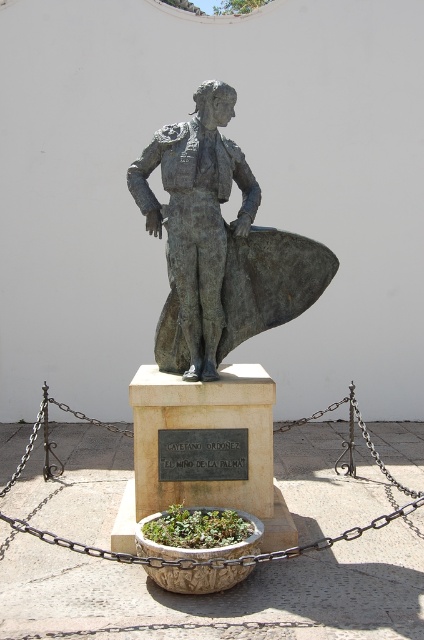
Is bronze statue at center smaller than rusty metal chain at center?

Answer: Incorrect, bronze statue at center is not smaller in size than rusty metal chain at center.

Is the position of bronze statue at center more distant than that of rusty metal chain at center?

No, bronze statue at center is in front of rusty metal chain at center.

Is point (167, 134) positioned after point (19, 468)?

No, (167, 134) is in front of (19, 468).

You are a GUI agent. You are given a task and a screenshot of the screen. Output one action in this format:
    pyautogui.click(x=<x>, y=<y>)
    Task: Click on the bronze statue at center
    
    Given the screenshot: What is the action you would take?
    pyautogui.click(x=219, y=243)